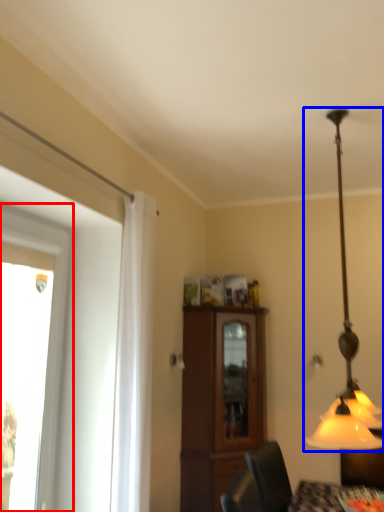
Question: Which object appears closest to the camera in this image, window (highlighted by a red box) or lamp (highlighted by a blue box)?

Choices:
 (A) window
 (B) lamp

Answer: (B)